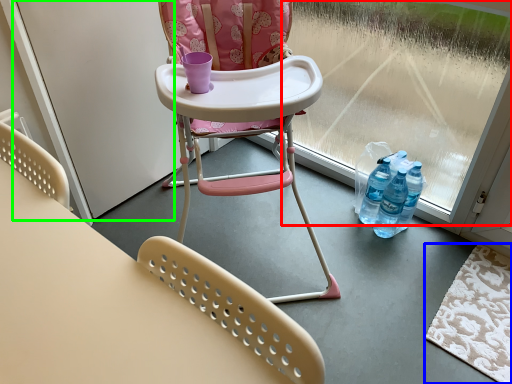
Question: Considering the real-world distances, which object is closest to window screen (highlighted by a red box)? mat (highlighted by a blue box) or screen door (highlighted by a green box).

Choices:
 (A) mat
 (B) screen door

Answer: (A)